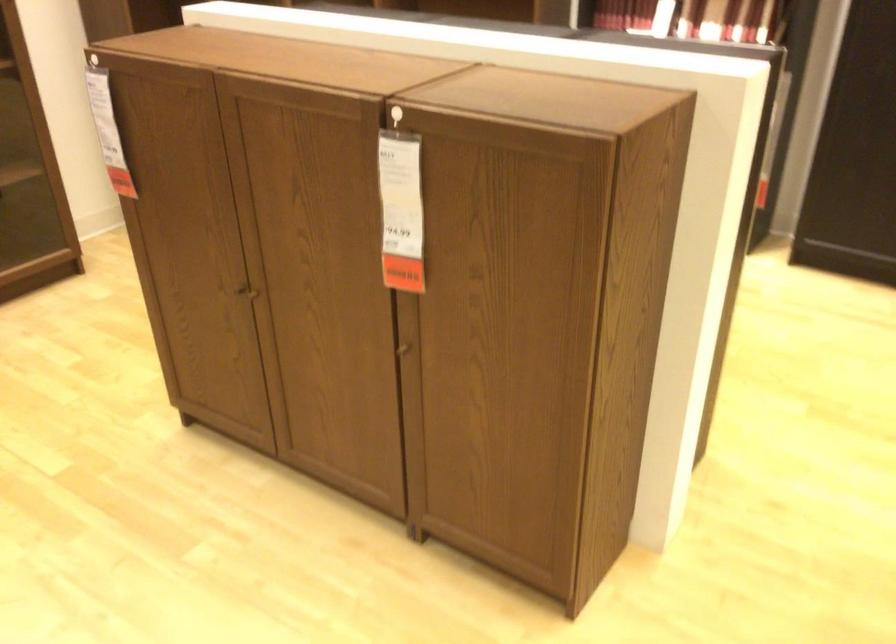
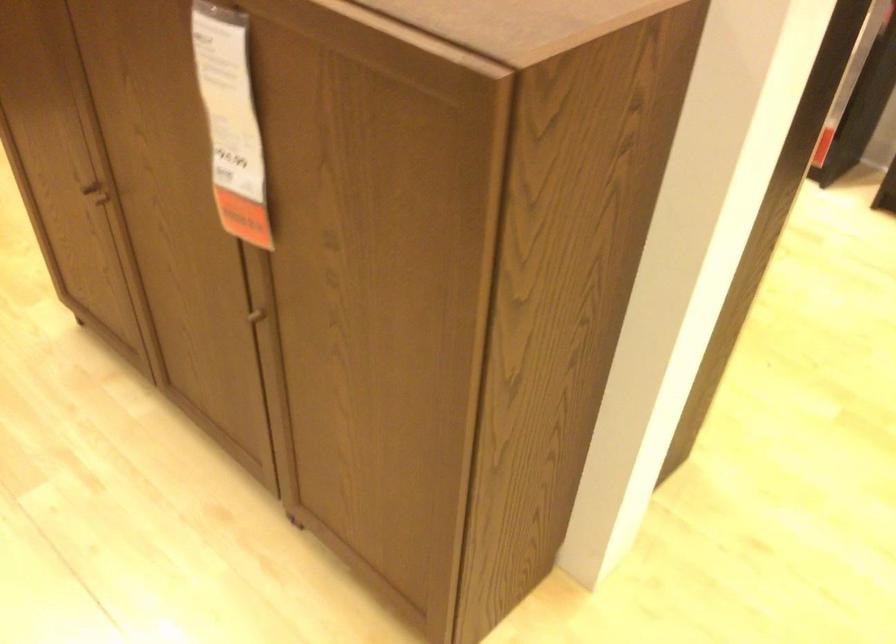
Locate, in the second image, the point that corresponds to the point at 408,348 in the first image.

(262, 314)